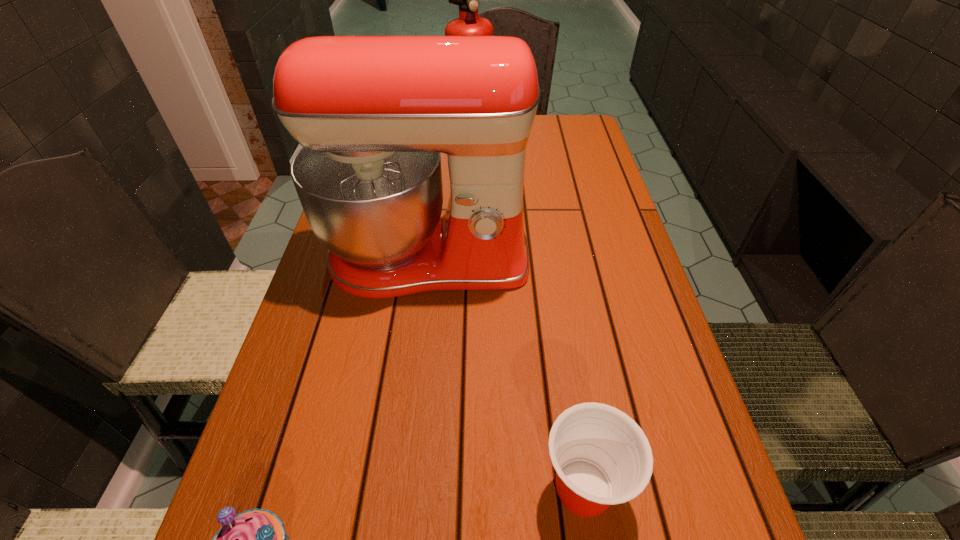
Where is `vacant space at the far right corner`? The width and height of the screenshot is (960, 540). vacant space at the far right corner is located at coordinates click(x=576, y=114).

Where is `vacant space that's between the third tallest object and the mixer`? This screenshot has height=540, width=960. vacant space that's between the third tallest object and the mixer is located at coordinates (505, 374).

Find the location of `empty space between the cup and the farthest object`. empty space between the cup and the farthest object is located at coordinates (532, 319).

This screenshot has height=540, width=960. In order to click on vacant space that is in between the mixer and the cup in this screenshot , I will do `click(505, 374)`.

The height and width of the screenshot is (540, 960). I want to click on object identified as the closest to the fire extinguisher, so click(373, 113).

The image size is (960, 540). I want to click on object that can be found as the second closest to the third nearest object, so click(x=601, y=456).

The width and height of the screenshot is (960, 540). I want to click on vacant area in the image that satisfies the following two spatial constraints: 1. on the front-facing side of the fire extinguisher; 2. on the left side of the second shortest object, so click(x=481, y=488).

Identify the location of vacant space that satisfies the following two spatial constraints: 1. on the front-facing side of the cup; 2. on the left side of the second farthest object. (400, 488).

At what (x,y) coordinates should I click in order to perform the action: click on free space that satisfies the following two spatial constraints: 1. on the front-facing side of the fire extinguisher; 2. on the right side of the cup. Please return your answer as a coordinate pair (x, y). Looking at the image, I should click on (481, 488).